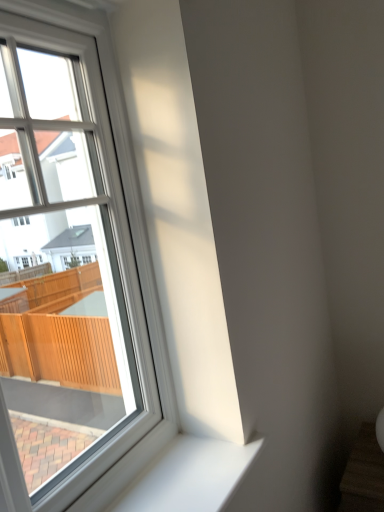
Question: In terms of width, does white smooth window sill at lower left look wider or thinner when compared to white plastic window at upper left?

Choices:
 (A) thin
 (B) wide

Answer: (B)

Question: Is point (221, 499) closer or farther from the camera than point (160, 337)?

Choices:
 (A) farther
 (B) closer

Answer: (B)

Question: From the image's perspective, is white smooth window sill at lower left located above or below white plastic window at upper left?

Choices:
 (A) below
 (B) above

Answer: (A)

Question: Is white plastic window at upper left wider or thinner than white smooth window sill at lower left?

Choices:
 (A) wide
 (B) thin

Answer: (B)

Question: Considering their positions, is white plastic window at upper left located in front of or behind white smooth window sill at lower left?

Choices:
 (A) behind
 (B) front

Answer: (B)

Question: From a real-world perspective, is white plastic window at upper left above or below white smooth window sill at lower left?

Choices:
 (A) below
 (B) above

Answer: (B)

Question: From the image's perspective, relative to white smooth window sill at lower left, is white plastic window at upper left above or below?

Choices:
 (A) below
 (B) above

Answer: (B)